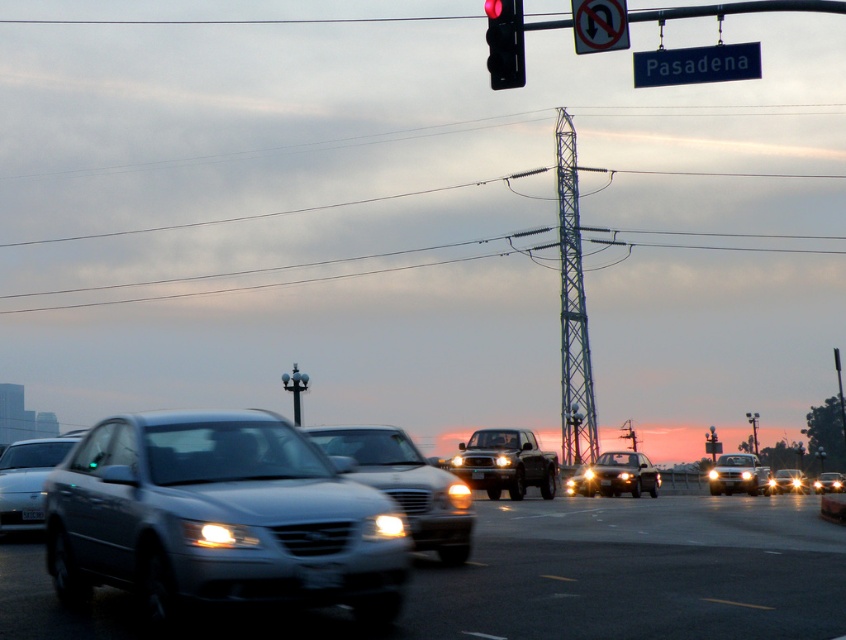
Question: Which object is farther from the camera taking this photo?

Choices:
 (A) sleek silver sedan at center
 (B) white plastic license plate at center
 (C) shiny black suv at center
 (D) black plastic traffic light at upper center

Answer: (C)

Question: Is black plastic traffic light at upper center wider than shiny silver suv at center?

Choices:
 (A) yes
 (B) no

Answer: (B)

Question: Estimate the real-world distances between objects in this image. Which object is farther from the blue plastic street sign at upper center?

Choices:
 (A) shiny black suv at center
 (B) white plastic license plate at center
 (C) black plastic traffic light at upper center
 (D) shiny silver suv at center

Answer: (D)

Question: Which object is closer to the camera taking this photo?

Choices:
 (A) sleek silver sedan at center
 (B) shiny silver suv at center

Answer: (A)

Question: Is black plastic no u-turn sign at upper center positioned behind shiny black suv at center?

Choices:
 (A) no
 (B) yes

Answer: (A)

Question: Is black plastic no u-turn sign at upper center bigger than metallic silver sedan at center?

Choices:
 (A) yes
 (B) no

Answer: (B)